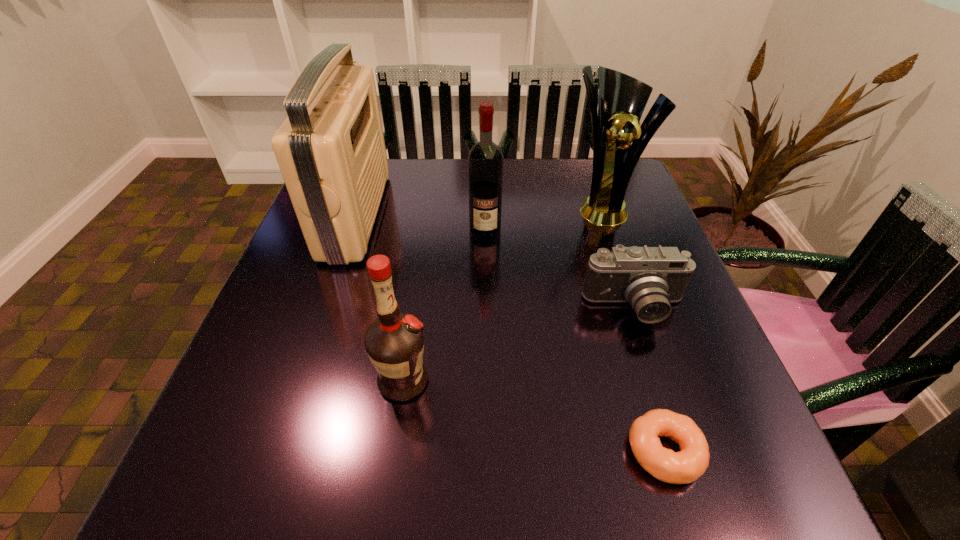
Identify the location of vacant space located at the front of the award, where the globe is visible. (629, 289).

Where is `vacant point located 0.320m on the front and back of the third object from left to right`? The height and width of the screenshot is (540, 960). vacant point located 0.320m on the front and back of the third object from left to right is located at coordinates (487, 351).

You are a GUI agent. You are given a task and a screenshot of the screen. Output one action in this format:
    pyautogui.click(x=<x>, y=<y>)
    Task: Click on the vacant space positioned 0.300m on the front and back of the second object from left to right
    This screenshot has height=540, width=960.
    Given the screenshot: What is the action you would take?
    pyautogui.click(x=605, y=381)

Image resolution: width=960 pixels, height=540 pixels. Identify the location of vacant space positioned on the front-facing side of the second shortest object. [x=661, y=386].

In order to click on vacant space located 0.180m on the left of the nearest object in this screenshot , I will do `click(508, 451)`.

At what (x,y) coordinates should I click in order to perform the action: click on radio receiver present at the far edge. Please return your answer as a coordinate pair (x, y). Image resolution: width=960 pixels, height=540 pixels. Looking at the image, I should click on (331, 152).

Locate an element on the screen. This screenshot has height=540, width=960. award positioned at the far edge is located at coordinates (622, 99).

The height and width of the screenshot is (540, 960). Find the location of `object positioned at the near edge`. object positioned at the near edge is located at coordinates (687, 465).

The height and width of the screenshot is (540, 960). Identify the location of object located in the left edge section of the desktop. (331, 152).

The image size is (960, 540). What are the coordinates of `award positioned at the right edge` in the screenshot? It's located at (622, 99).